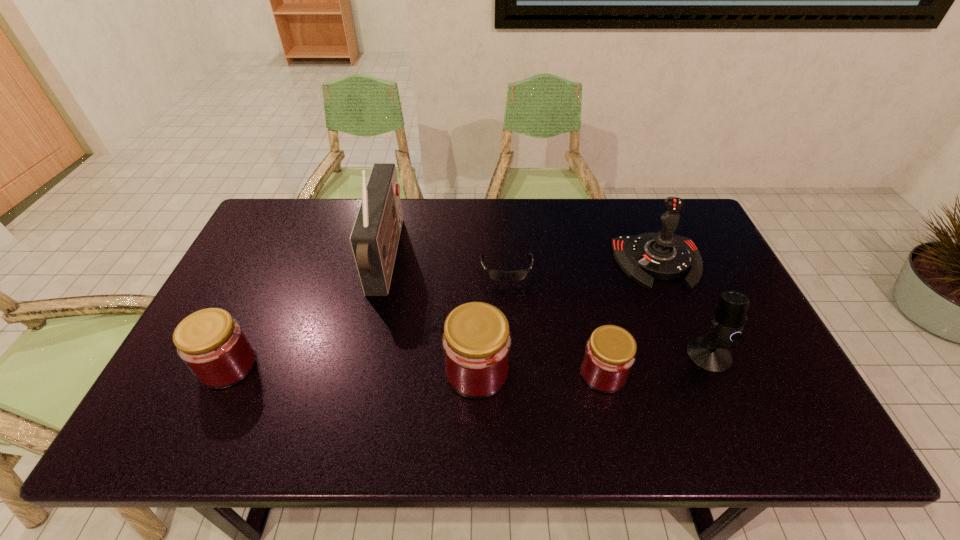
At what (x,y) coordinates should I click in order to perform the action: click on joystick positioned at the right edge. Please return your answer as a coordinate pair (x, y). The height and width of the screenshot is (540, 960). Looking at the image, I should click on (663, 255).

Image resolution: width=960 pixels, height=540 pixels. Find the location of `microphone that is at the right edge`. microphone that is at the right edge is located at coordinates pos(710,353).

This screenshot has width=960, height=540. Identify the location of object located in the near left corner section of the desktop. [213, 345].

You are a GUI agent. You are given a task and a screenshot of the screen. Output one action in this format:
    pyautogui.click(x=<x>, y=<y>)
    Task: Click on the object positioned at the far right corner
    Image resolution: width=960 pixels, height=540 pixels.
    Given the screenshot: What is the action you would take?
    pyautogui.click(x=663, y=255)

Find the location of `object that is at the near right corner`. object that is at the near right corner is located at coordinates (710, 353).

This screenshot has height=540, width=960. I want to click on vacant space at the far edge of the desktop, so click(414, 208).

The width and height of the screenshot is (960, 540). Identify the location of free region at the near edge of the desktop. (430, 393).

Find the location of a particular element. The width and height of the screenshot is (960, 540). vacant position at the left edge of the desktop is located at coordinates (252, 258).

Where is `free space at the far left corner of the desktop`? The width and height of the screenshot is (960, 540). free space at the far left corner of the desktop is located at coordinates (301, 230).

The height and width of the screenshot is (540, 960). I want to click on free region at the near left corner of the desktop, so click(x=192, y=402).